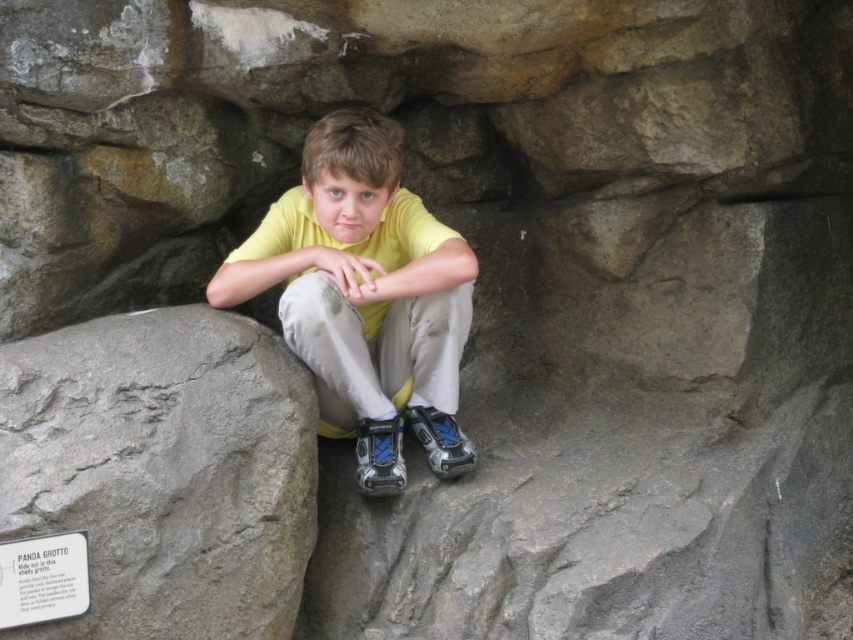
Can you confirm if gray rough rock at lower left is positioned below white paper sign at lower left?

Actually, gray rough rock at lower left is above white paper sign at lower left.

Does gray rough rock at lower left appear on the right side of white paper sign at lower left?

Indeed, gray rough rock at lower left is positioned on the right side of white paper sign at lower left.

Which is in front, point (149, 564) or point (48, 557)?

Point (48, 557) is more forward.

I want to click on gray rough rock at lower left, so click(164, 470).

In the scene shown: Who is positioned more to the right, yellow matte shirt at center or white paper sign at lower left?

yellow matte shirt at center

Can you confirm if yellow matte shirt at center is shorter than white paper sign at lower left?

No, yellow matte shirt at center is not shorter than white paper sign at lower left.

Where is `yellow matte shirt at center`? The width and height of the screenshot is (853, 640). yellow matte shirt at center is located at coordinates (364, 296).

Between point (212, 531) and point (354, 362), which one is positioned behind?

The point (354, 362) is more distant.

Who is lower down, gray rough rock at lower left or yellow matte shirt at center?

gray rough rock at lower left is lower down.

Is point (9, 426) behind point (451, 237)?

No, (9, 426) is closer to viewer.

Find the location of a particular element. gray rough rock at lower left is located at coordinates click(x=164, y=470).